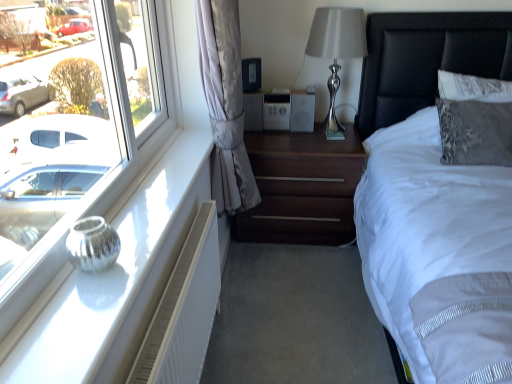
Identify the location of free spot in front of satin silver lamp at upper right. (323, 148).